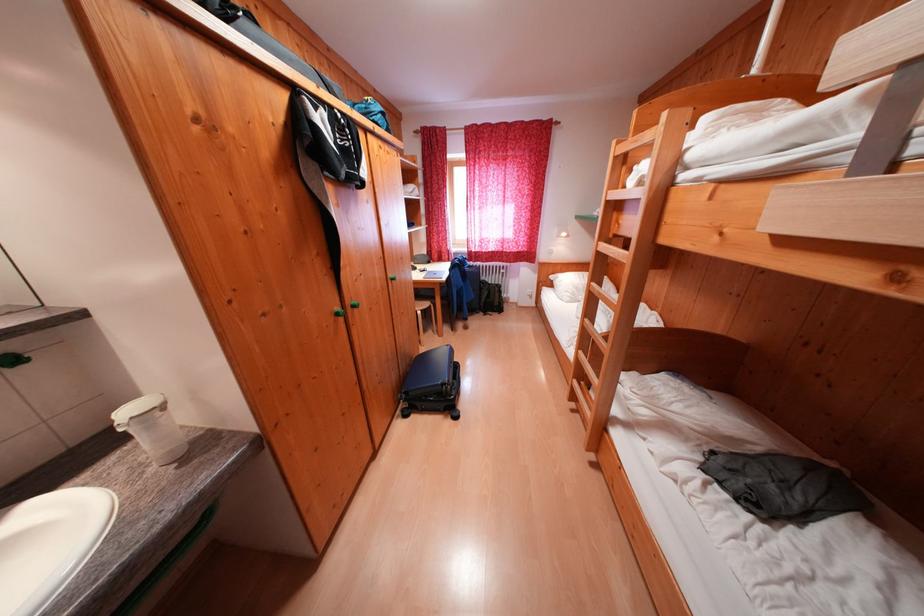
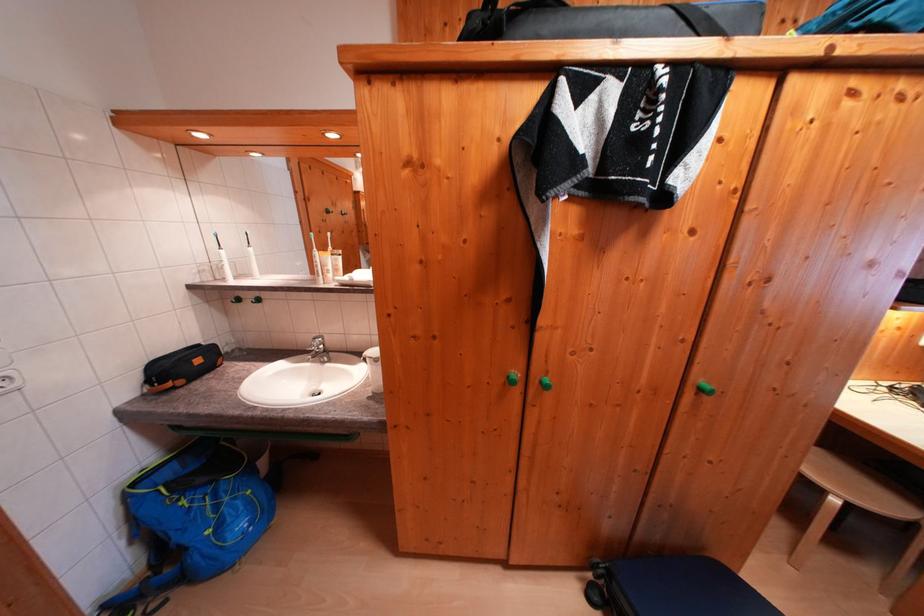
The point at (428,315) is marked in the first image. Where is the corresponding point in the second image?

(843, 505)